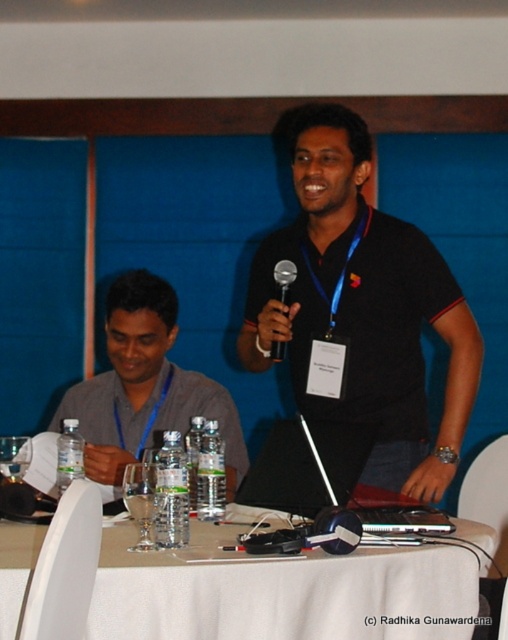
In the scene shown: You are organizing a photo shoot and need to ensure that the gray fabric shirt at left and the silver metallic microphone at center are both visible in the frame. Based on their positions and sizes, which object should you prioritize keeping centered to ensure both are in the shot?

The gray fabric shirt at left might be wider than the silver metallic microphone at center, so prioritizing the microphone at center would allow both to fit within the frame more easily.

You are a technician setting up for a presentation. The white cloth table at center is where the equipment needs to be placed. The silver metallic microphone at center is already positioned. If the required distance between the table and the microphone is exactly 30 inches for optimal sound pickup, is the current placement sufficient?

The distance between the white cloth table at center and the silver metallic microphone at center is 32.20 inches, which is 2.20 inches more than the required 30 inches. Therefore, the current placement is slightly insufficient for optimal sound pickup.